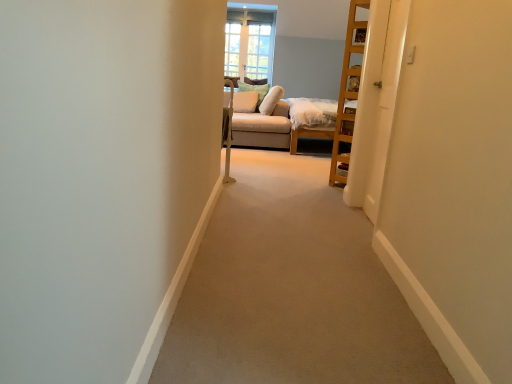
Question: From a real-world perspective, does white soft pillow at upper center, the second pillow positioned from the right, sit lower than clear glass window at upper center?

Choices:
 (A) yes
 (B) no

Answer: (A)

Question: From a real-world perspective, is white soft pillow at upper center, the second pillow positioned from the right, located higher than clear glass window at upper center?

Choices:
 (A) yes
 (B) no

Answer: (B)

Question: Could you tell me if white soft pillow at upper center, the second pillow positioned from the right, is turned towards clear glass window at upper center?

Choices:
 (A) yes
 (B) no

Answer: (B)

Question: Can you confirm if white soft pillow at upper center, the second pillow positioned from the right, is wider than clear glass window at upper center?

Choices:
 (A) yes
 (B) no

Answer: (A)

Question: From the image's perspective, does white soft pillow at upper center, the second pillow positioned from the right, appear higher than clear glass window at upper center?

Choices:
 (A) yes
 (B) no

Answer: (B)

Question: Visually, is clear glass window at upper center positioned to the left or to the right of suede beige couch at center?

Choices:
 (A) left
 (B) right

Answer: (A)

Question: Considering their positions, is clear glass window at upper center located in front of or behind suede beige couch at center?

Choices:
 (A) behind
 (B) front

Answer: (A)

Question: From the image's perspective, relative to suede beige couch at center, is clear glass window at upper center above or below?

Choices:
 (A) below
 (B) above

Answer: (B)

Question: Considering the positions of clear glass window at upper center and suede beige couch at center in the image, is clear glass window at upper center taller or shorter than suede beige couch at center?

Choices:
 (A) short
 (B) tall

Answer: (B)

Question: Does point pyautogui.click(x=234, y=102) appear closer or farther from the camera than point pyautogui.click(x=376, y=155)?

Choices:
 (A) farther
 (B) closer

Answer: (A)

Question: Considering the positions of white fabric pillow at center, which is the third pillow from right to left, and white glossy door at right in the image, is white fabric pillow at center, which is the third pillow from right to left, wider or thinner than white glossy door at right?

Choices:
 (A) wide
 (B) thin

Answer: (A)

Question: From the image's perspective, is white fabric pillow at center, the first pillow positioned from the left, above or below white glossy door at right?

Choices:
 (A) below
 (B) above

Answer: (B)

Question: In the image, is white fabric pillow at center, which is the third pillow from right to left, on the left side or the right side of white glossy door at right?

Choices:
 (A) right
 (B) left

Answer: (B)

Question: In terms of width, does white soft pillow at upper center, the second pillow positioned from the right, look wider or thinner when compared to suede beige couch at center?

Choices:
 (A) thin
 (B) wide

Answer: (A)

Question: Based on their sizes in the image, would you say white soft pillow at upper center, arranged as the 2th pillow when viewed from the left, is bigger or smaller than suede beige couch at center?

Choices:
 (A) small
 (B) big

Answer: (A)